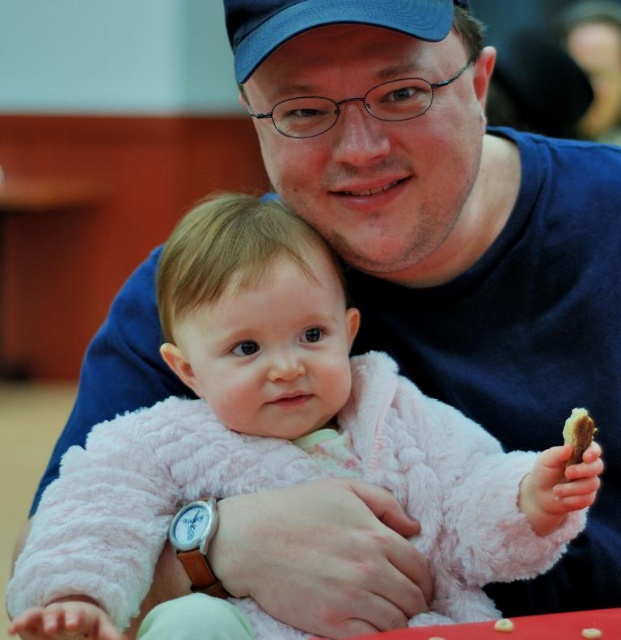
Question: Is blue fabric baseball cap at upper center bigger than yellow crumbly cookie at lower center?

Choices:
 (A) no
 (B) yes

Answer: (B)

Question: Which point is farther to the camera?

Choices:
 (A) (245, 17)
 (B) (499, 628)
 (C) (183, 464)

Answer: (C)

Question: Is pink fluffy sweater at center positioned at the back of yellow crumbly cookie at lower center?

Choices:
 (A) yes
 (B) no

Answer: (B)

Question: Does brown crumbly cookie at lower right appear under brown crumbly cookie at center?

Choices:
 (A) no
 (B) yes

Answer: (A)

Question: Which object is farther from the camera taking this photo?

Choices:
 (A) brown crumbly cookie at lower right
 (B) blue fabric baseball cap at upper center
 (C) pink fluffy sweater at center

Answer: (B)

Question: Which of the following is the farthest from the observer?

Choices:
 (A) blue fabric baseball cap at upper center
 (B) pink fluffy sweater at center

Answer: (A)